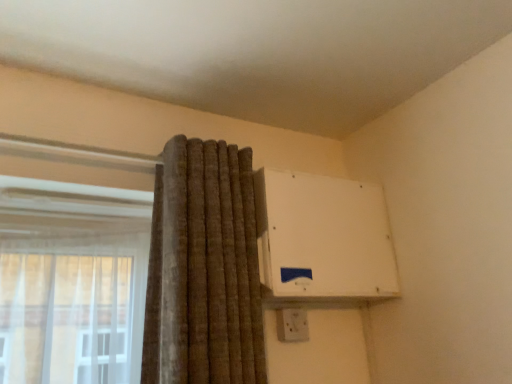
Question: From the image's perspective, is white plastic air conditioning unit at upper right over white plastic electric outlet at upper right?

Choices:
 (A) yes
 (B) no

Answer: (A)

Question: Does white plastic air conditioning unit at upper right turn towards white plastic electric outlet at upper right?

Choices:
 (A) no
 (B) yes

Answer: (A)

Question: Is white plastic air conditioning unit at upper right positioned behind white plastic electric outlet at upper right?

Choices:
 (A) no
 (B) yes

Answer: (A)

Question: Is white plastic air conditioning unit at upper right to the left of white plastic electric outlet at upper right from the viewer's perspective?

Choices:
 (A) yes
 (B) no

Answer: (B)

Question: Does white plastic air conditioning unit at upper right have a greater height compared to white plastic electric outlet at upper right?

Choices:
 (A) no
 (B) yes

Answer: (B)

Question: Is white plastic air conditioning unit at upper right in contact with white plastic electric outlet at upper right?

Choices:
 (A) no
 (B) yes

Answer: (A)

Question: Is white plastic electric outlet at upper right thinner than white plastic air conditioning unit at upper right?

Choices:
 (A) no
 (B) yes

Answer: (B)

Question: Can you confirm if white plastic electric outlet at upper right is smaller than white plastic air conditioning unit at upper right?

Choices:
 (A) no
 (B) yes

Answer: (B)

Question: Does white plastic electric outlet at upper right have a greater width compared to white plastic air conditioning unit at upper right?

Choices:
 (A) yes
 (B) no

Answer: (B)

Question: From the image's perspective, would you say white plastic electric outlet at upper right is shown under white plastic air conditioning unit at upper right?

Choices:
 (A) yes
 (B) no

Answer: (A)

Question: Is white plastic electric outlet at upper right aimed at white plastic air conditioning unit at upper right?

Choices:
 (A) yes
 (B) no

Answer: (B)

Question: Considering the relative sizes of white plastic electric outlet at upper right and white plastic air conditioning unit at upper right in the image provided, is white plastic electric outlet at upper right taller than white plastic air conditioning unit at upper right?

Choices:
 (A) no
 (B) yes

Answer: (A)

Question: Considering the positions of white plastic air conditioning unit at upper right and white plastic electric outlet at upper right in the image, is white plastic air conditioning unit at upper right wider or thinner than white plastic electric outlet at upper right?

Choices:
 (A) thin
 (B) wide

Answer: (B)